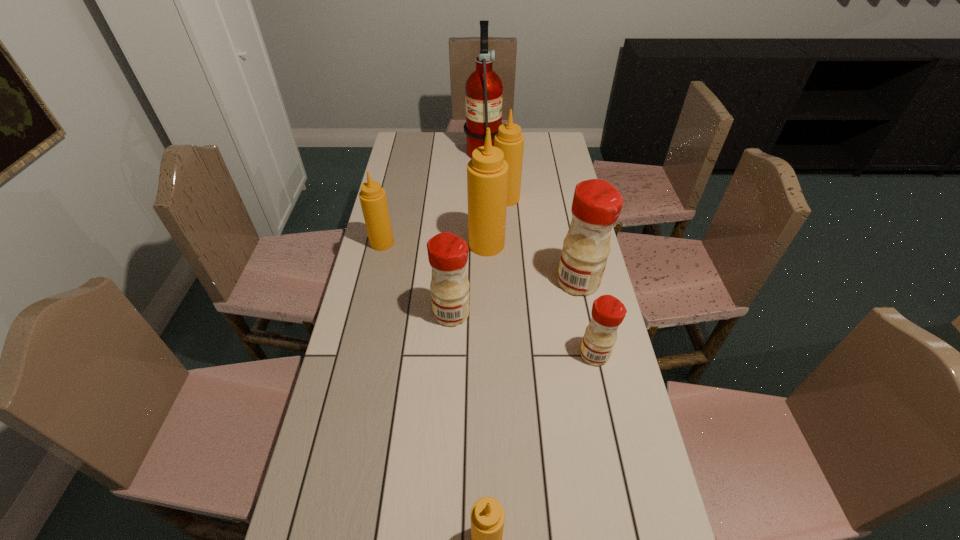
Find the location of a particular element. the second farthest red condiment is located at coordinates (448, 253).

This screenshot has width=960, height=540. Identify the location of the smallest red condiment. (608, 312).

Image resolution: width=960 pixels, height=540 pixels. I want to click on the second nearest condiment, so click(608, 312).

Locate an element on the screen. free spot located on the nozzle and handle of the farthest object is located at coordinates (413, 148).

Identify the location of vacant space located on the nozzle and handle of the farthest object. (447, 148).

Find the location of `free space located 0.120m on the nozzle and handle of the farthest object`. free space located 0.120m on the nozzle and handle of the farthest object is located at coordinates (439, 148).

Identify the location of vacant space located 0.330m on the left of the biggest tan condiment. The image size is (960, 540). (377, 244).

Where is `vacant position located 0.300m on the back of the farthest tan condiment`? This screenshot has height=540, width=960. vacant position located 0.300m on the back of the farthest tan condiment is located at coordinates (503, 153).

At what (x,y) coordinates should I click in order to perform the action: click on free space located on the back of the farthest red condiment. Please return your answer as a coordinate pair (x, y). Looking at the image, I should click on (561, 200).

This screenshot has width=960, height=540. Identify the location of vacant point located on the right of the leftmost tan condiment. (455, 243).